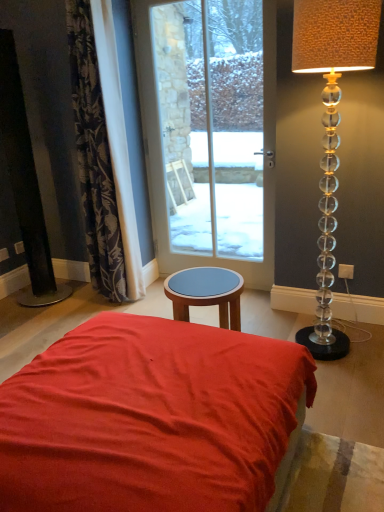
Question: Can you confirm if clear glass door at center is positioned to the left of dark floral fabric curtain at left?

Choices:
 (A) yes
 (B) no

Answer: (B)

Question: Does clear glass door at center appear on the right side of dark floral fabric curtain at left?

Choices:
 (A) yes
 (B) no

Answer: (A)

Question: Can you confirm if clear glass door at center is shorter than dark floral fabric curtain at left?

Choices:
 (A) yes
 (B) no

Answer: (B)

Question: Does clear glass door at center have a greater height compared to dark floral fabric curtain at left?

Choices:
 (A) yes
 (B) no

Answer: (A)

Question: From a real-world perspective, does clear glass door at center sit lower than dark floral fabric curtain at left?

Choices:
 (A) no
 (B) yes

Answer: (B)

Question: Considering the positions of translucent glass lamp at right and clear glass door at center in the image, is translucent glass lamp at right bigger or smaller than clear glass door at center?

Choices:
 (A) big
 (B) small

Answer: (B)

Question: Is translucent glass lamp at right inside the boundaries of clear glass door at center, or outside?

Choices:
 (A) outside
 (B) inside

Answer: (A)

Question: Is translucent glass lamp at right to the left or to the right of clear glass door at center in the image?

Choices:
 (A) right
 (B) left

Answer: (A)

Question: Considering the positions of point (332, 48) and point (155, 253), is point (332, 48) closer or farther from the camera than point (155, 253)?

Choices:
 (A) closer
 (B) farther

Answer: (A)

Question: Based on their sizes in the image, would you say dark floral fabric curtain at left is bigger or smaller than clear glass door at center?

Choices:
 (A) big
 (B) small

Answer: (A)

Question: Is point (117, 281) closer or farther from the camera than point (137, 58)?

Choices:
 (A) closer
 (B) farther

Answer: (B)

Question: From the image's perspective, is dark floral fabric curtain at left located above or below clear glass door at center?

Choices:
 (A) below
 (B) above

Answer: (A)

Question: From their relative heights in the image, would you say dark floral fabric curtain at left is taller or shorter than clear glass door at center?

Choices:
 (A) tall
 (B) short

Answer: (B)

Question: From a real-world perspective, relative to matte red fabric bed at center, is clear glass door at center vertically above or below?

Choices:
 (A) below
 (B) above

Answer: (B)

Question: Does point (160, 270) appear closer or farther from the camera than point (261, 351)?

Choices:
 (A) closer
 (B) farther

Answer: (B)